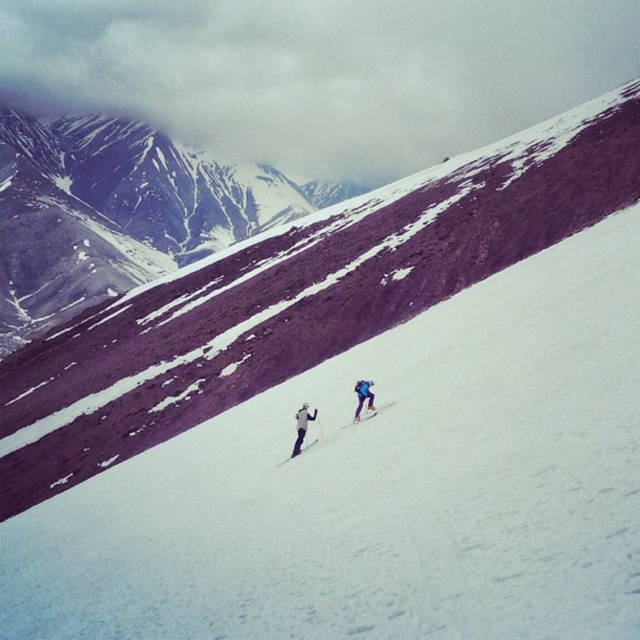
You are a photographer planning to capture the skiers against the snowy slope. You need to ensure the white matte ski at center stands out clearly from the white snow at center. Based on the scene description, what adjustment should you make to the camera settings?

The white snow at center is much taller than the white matte ski at center, so adjusting the camera focus to the lower part of the frame where the ski is positioned will help it stand out against the taller snow area.

You are a skier planning to make a turn on the slope. You see the white snow at center and the white matte ski at center. Which area is wider for you to maneuver?

The white snow at center is wider than the white matte ski at center, so you can maneuver more easily on the white snow at center.

You are a photographer standing on a mountain peak. You want to take a photo of the white snow at center and the white matte skier at center. Based on their heights, which one will appear larger in the photo?

The white snow at center is much taller than the white matte skier at center, so it will appear larger in the photo.